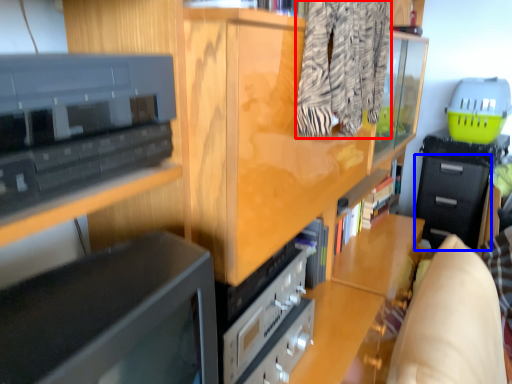
Question: Which of the following is the farthest to the observer, clothing (highlighted by a red box) or drawer (highlighted by a blue box)?

Choices:
 (A) clothing
 (B) drawer

Answer: (B)